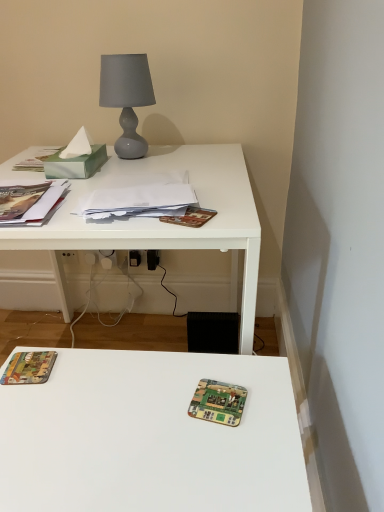
Find the location of a particular element. Image resolution: width=384 pixels, height=512 pixels. empty space that is ontop of white matte desk at upper left (from a real-world perspective) is located at coordinates (151, 173).